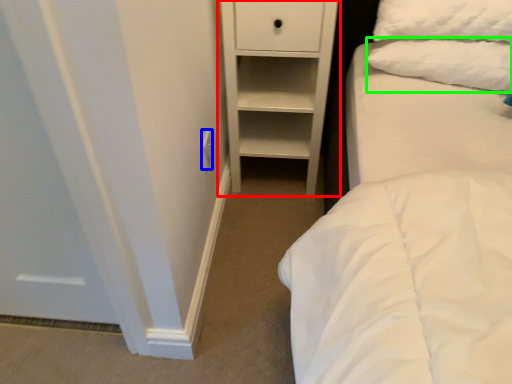
Question: Which is nearer to the chest of drawers (highlighted by a red box)? electric outlet (highlighted by a blue box) or pillow (highlighted by a green box).

Choices:
 (A) electric outlet
 (B) pillow

Answer: (B)